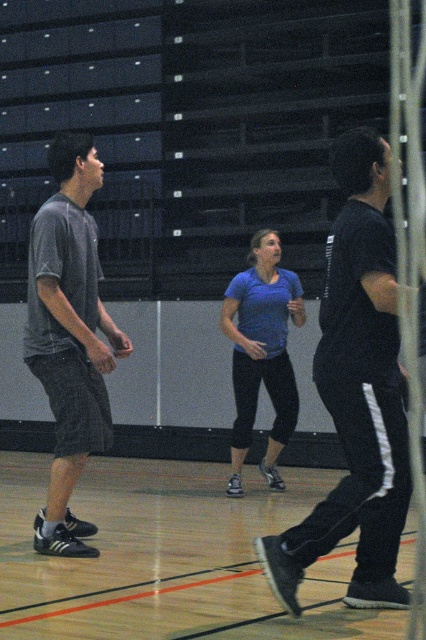
Who is higher up, wooden floor at center or blue matte shirt at center?

blue matte shirt at center is above.

Can you confirm if wooden floor at center is positioned to the left of blue matte shirt at center?

Correct, you'll find wooden floor at center to the left of blue matte shirt at center.

You are a GUI agent. You are given a task and a screenshot of the screen. Output one action in this format:
    pyautogui.click(x=<x>, y=<y>)
    Task: Click on the wooden floor at center
    
    Given the screenshot: What is the action you would take?
    pyautogui.click(x=169, y=557)

Which is below, wooden floor at center or black matte pants at right?

wooden floor at center is below.

Which is behind, point (221, 504) or point (362, 211)?

The point (221, 504) is behind.

The height and width of the screenshot is (640, 426). Identify the location of wooden floor at center. (169, 557).

Is wooden floor at center shorter than dark gray shorts at left?

Correct, wooden floor at center is not as tall as dark gray shorts at left.

Which is in front, point (146, 588) or point (63, 467)?

Positioned in front is point (146, 588).

Identify the location of wooden floor at center. (169, 557).